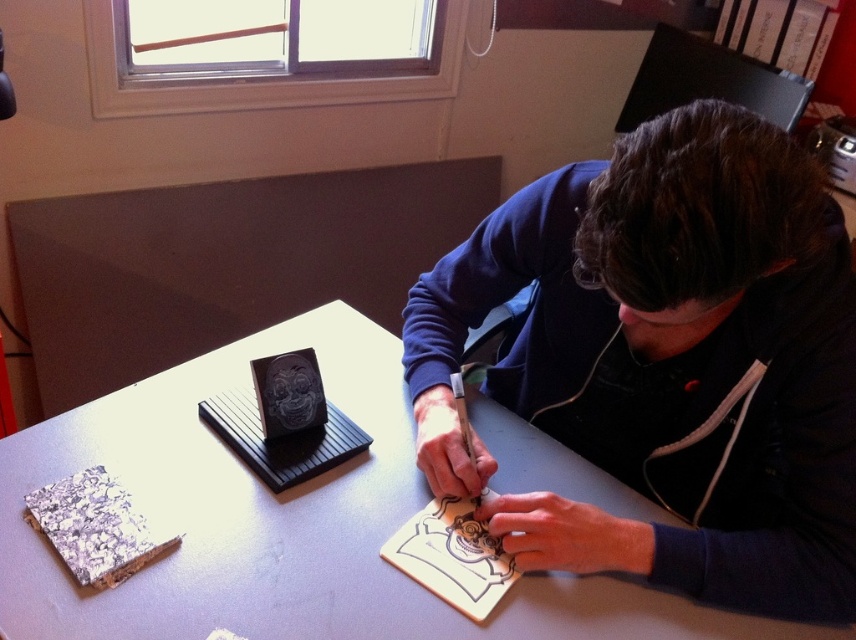
You are organizing a craft fair booth and need to arrange items on the table. You have a dark blue hoodie at center and a white matte table at center. Where should you place the hoodie relative to the table to match the image?

The dark blue hoodie at center should be placed to the right of the white matte table at center as shown in the image.

You are a photographer standing at a specific position. You want to take a closeup photo of the dark blue hoodie at center. Can you get close enough to capture the hoodie without moving your position?

The dark blue hoodie at center is 26.51 inches away from the camera, so yes, you can take a closeup photo without moving since the distance is sufficient for focusing.

From the picture: You are a photographer setting up a shoot. You need to place a dark blue hoodie at center and a white matte table at center in the scene. According to the description, where should the dark blue hoodie be positioned relative to the white matte table?

The dark blue hoodie at center should be placed above the white matte table at center as per the description.